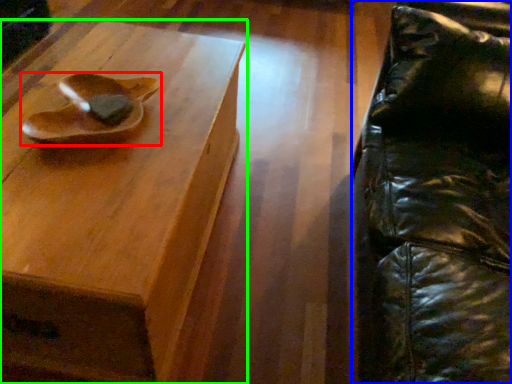
Question: Which is nearer to the footwear (highlighted by a red box)? swivel chair (highlighted by a blue box) or table (highlighted by a green box).

Choices:
 (A) swivel chair
 (B) table

Answer: (B)